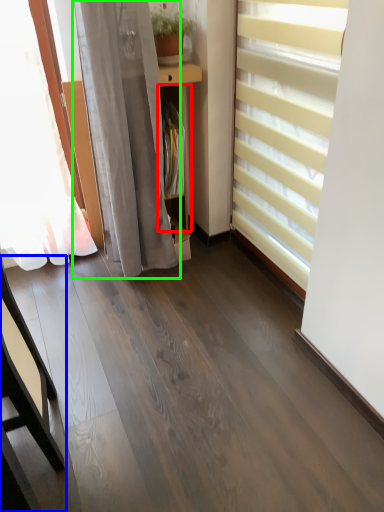
Question: Considering the real-world distances, which object is closest to shelf (highlighted by a red box)? furniture (highlighted by a blue box) or curtain (highlighted by a green box).

Choices:
 (A) furniture
 (B) curtain

Answer: (B)